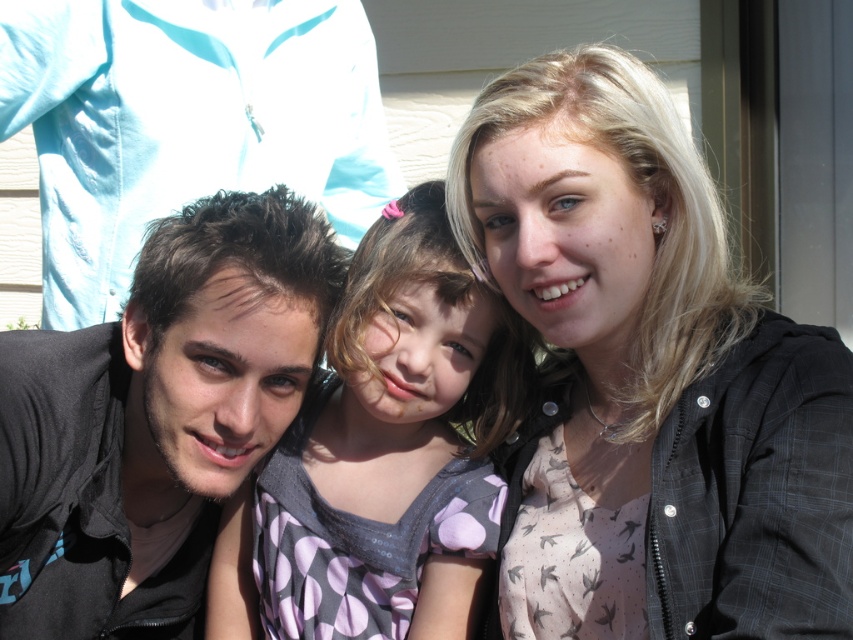
Question: Can you confirm if blonde hair at upper right is thinner than dark brown hair at left?

Choices:
 (A) no
 (B) yes

Answer: (A)

Question: Is blonde hair at upper right closer to camera compared to polka dot fabric dress at center?

Choices:
 (A) yes
 (B) no

Answer: (A)

Question: Estimate the real-world distances between objects in this image. Which object is closer to the blonde hair at upper right?

Choices:
 (A) polka dot fabric dress at center
 (B) dark brown hair at left

Answer: (A)

Question: Which point is farther to the camera?

Choices:
 (A) blonde hair at upper right
 (B) polka dot fabric dress at center
 (C) dark brown hair at left

Answer: (B)

Question: Is blonde hair at upper right in front of polka dot fabric dress at center?

Choices:
 (A) no
 (B) yes

Answer: (B)

Question: Among these points, which one is nearest to the camera?

Choices:
 (A) (663, 579)
 (B) (374, 316)
 (C) (108, 429)

Answer: (A)